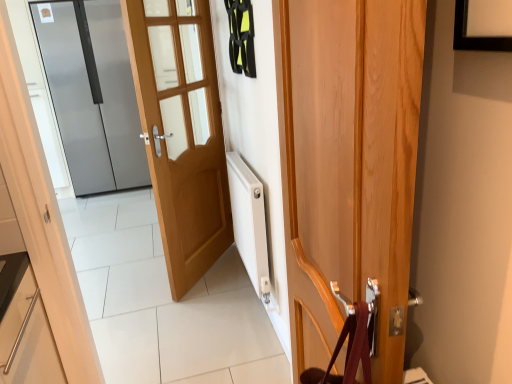
Question: Would you say light brown wood door at center, which is counted as the 2th door, starting from the front, is to the left or to the right of satin silver refrigerator at left, which is the first door from left to right, in the picture?

Choices:
 (A) left
 (B) right

Answer: (B)

Question: Considering the positions of light brown wood door at center, positioned as the 2th door in back-to-front order, and satin silver refrigerator at left, the third door from the right, in the image, is light brown wood door at center, positioned as the 2th door in back-to-front order, wider or thinner than satin silver refrigerator at left, the third door from the right,?

Choices:
 (A) thin
 (B) wide

Answer: (A)

Question: Which of these objects is positioned closest to the light brown wood door at center, the 2th door viewed from the right?

Choices:
 (A) satin silver refrigerator at left, which is the first door from left to right
 (B) wooden door at center, the 3th door viewed from the left

Answer: (B)

Question: Which of these objects is positioned closest to the satin silver refrigerator at left, the third door from the right?

Choices:
 (A) wooden door at center, which is counted as the third door, starting from the back
 (B) light brown wood door at center, which is counted as the 2th door, starting from the front

Answer: (B)